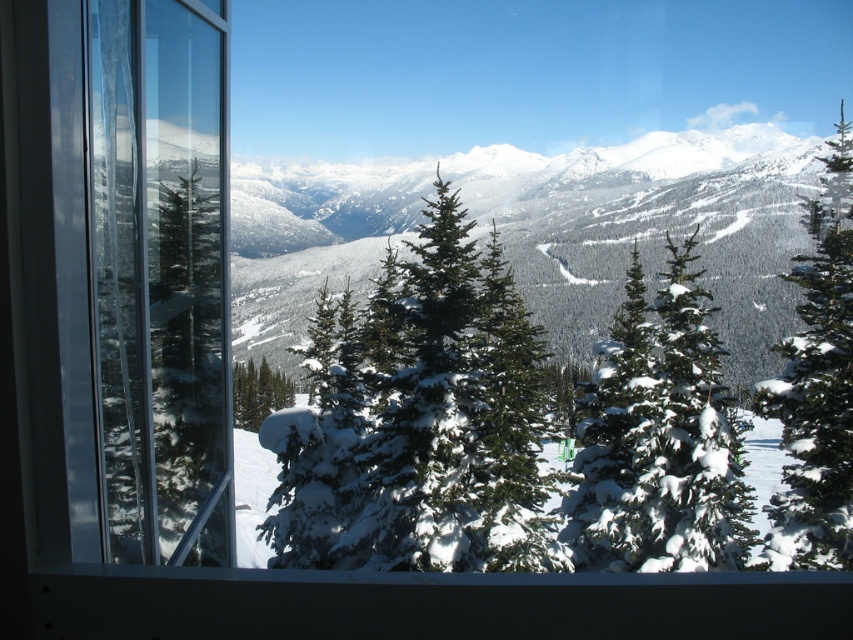
Question: Is the position of snow-covered evergreen trees at center more distant than that of green matte tree at center?

Choices:
 (A) no
 (B) yes

Answer: (B)

Question: Does snow-covered evergreen at center have a greater width compared to green textured pine tree at right?

Choices:
 (A) yes
 (B) no

Answer: (B)

Question: Does snow-covered evergreen at center have a lesser width compared to green textured pine tree at right?

Choices:
 (A) no
 (B) yes

Answer: (B)

Question: Estimate the real-world distances between objects in this image. Which object is farther from the snow-covered evergreen at center?

Choices:
 (A) snow-covered evergreen trees at center
 (B) green textured pine tree at right

Answer: (A)

Question: Which of these objects is positioned closest to the snow-covered evergreen at center?

Choices:
 (A) transparent glass window at left
 (B) green textured pine tree at right
 (C) snow-covered evergreen trees at center
 (D) green textured pine tree at center

Answer: (D)

Question: Which point is closer to the camera taking this photo?

Choices:
 (A) (283, 396)
 (B) (155, 40)
 (C) (682, 380)

Answer: (B)